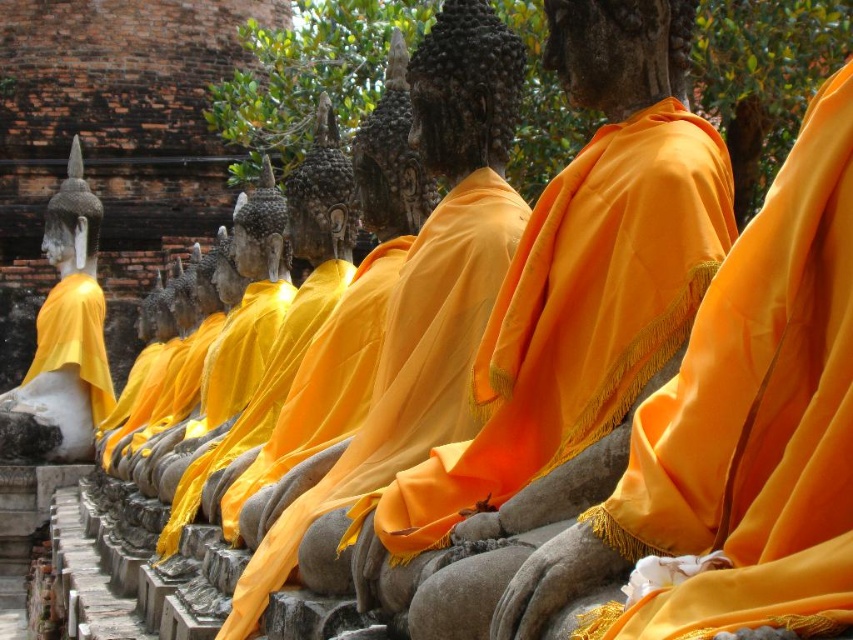
You are an artist setting up a camera to photograph the row of seated Buddha statues. You want to focus on the matte yellow cloth at center. Where should you position your camera relative to the statues to ensure the cloth is centered in your shot?

The matte yellow cloth at center is located at point coordinates, so position your camera directly in front of the statues at the specified coordinates to center the cloth in your shot.

You are an art restorer examining the row of Buddha statues. You need to place a protective cloth over the orange silk cloth at center and the matte gold statue at left. Which object should you cover first to avoid obstructing the view of the other?

The orange silk cloth at center is closer to the viewer than the matte gold statue at left, so you should cover the matte gold statue at left first to avoid blocking the view of the orange silk cloth at center.